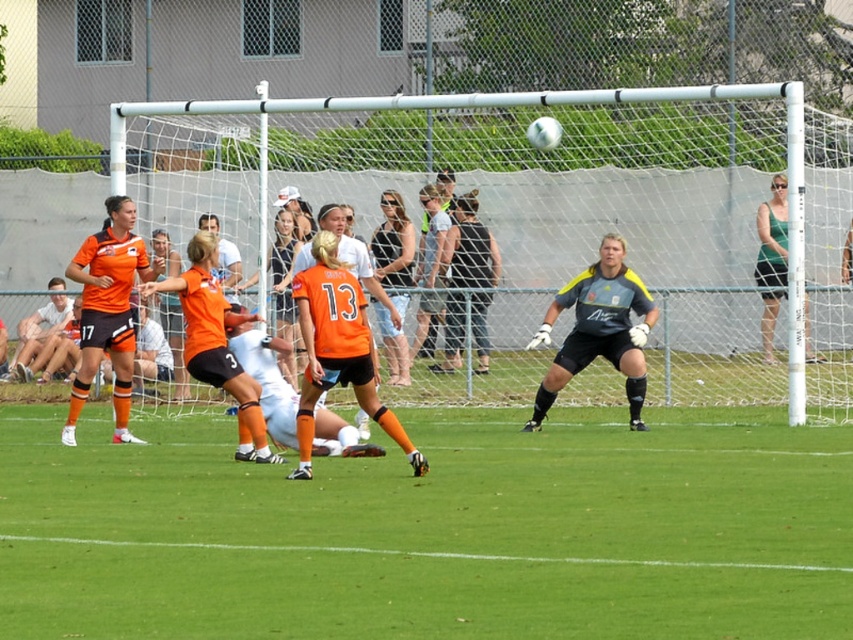
Is green grass at center smaller than green fabric tank top at upper right?

No.

Is point (177, 490) closer to camera compared to point (775, 298)?

Yes, it is in front of point (775, 298).

Image resolution: width=853 pixels, height=640 pixels. I want to click on green grass at center, so click(432, 531).

Is green grass at center shorter than gray-yellow jersey at center?

Indeed, green grass at center has a lesser height compared to gray-yellow jersey at center.

Can you confirm if green grass at center is smaller than gray-yellow jersey at center?

→ Incorrect, green grass at center is not smaller in size than gray-yellow jersey at center.

This screenshot has width=853, height=640. In order to click on green grass at center in this screenshot , I will do `click(432, 531)`.

The image size is (853, 640). I want to click on green grass at center, so click(432, 531).

Measure the distance between green grass at center and orange matte jersey at left.

green grass at center is 3.45 meters from orange matte jersey at left.

Describe the element at coordinates (432, 531) in the screenshot. I see `green grass at center` at that location.

Is point (80, 579) behind point (105, 202)?

That is False.

Where is `green grass at center`? This screenshot has width=853, height=640. green grass at center is located at coordinates (432, 531).